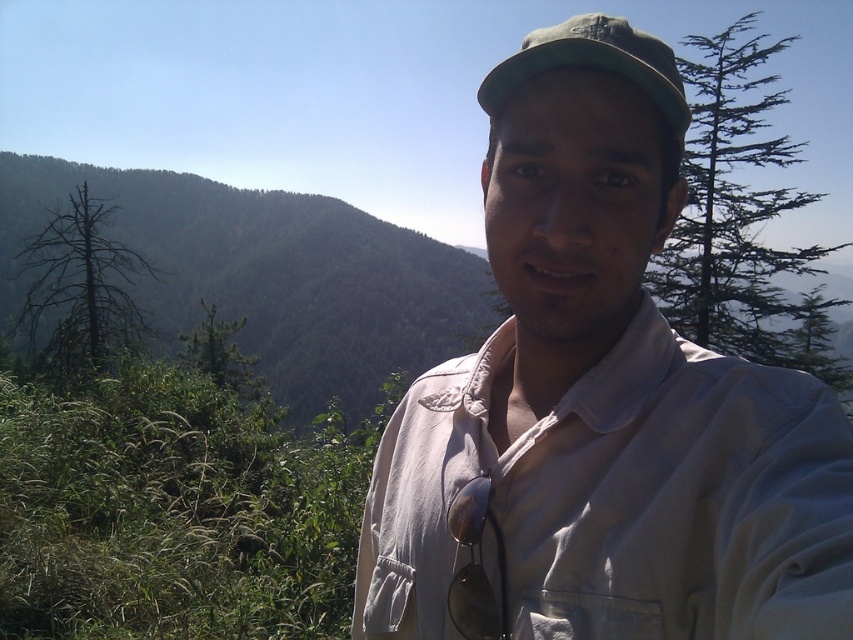
Question: Considering the real-world distances, which object is closest to the green coniferous tree at upper right?

Choices:
 (A) green fabric cap at upper center
 (B) white cotton shirt at center

Answer: (A)

Question: Among these objects, which one is farthest from the camera?

Choices:
 (A) green fabric cap at upper center
 (B) white cotton shirt at center

Answer: (A)

Question: Can you confirm if white cotton shirt at center is smaller than dead brown tree at left?

Choices:
 (A) yes
 (B) no

Answer: (A)

Question: Among these objects, which one is nearest to the camera?

Choices:
 (A) green coniferous tree at upper right
 (B) green fabric cap at upper center

Answer: (B)

Question: Where is green coniferous tree at upper right located in relation to dead brown tree at left in the image?

Choices:
 (A) below
 (B) above

Answer: (B)

Question: In this image, where is white cotton shirt at center located relative to dead brown tree at left?

Choices:
 (A) above
 (B) below

Answer: (B)